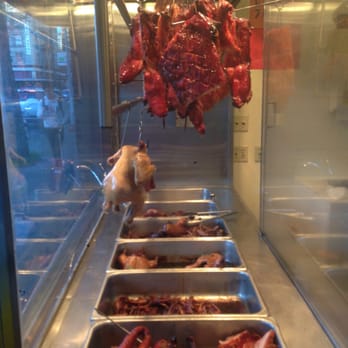
Identify the location of silver metallic buffet surfaces. (278, 276), (91, 282).